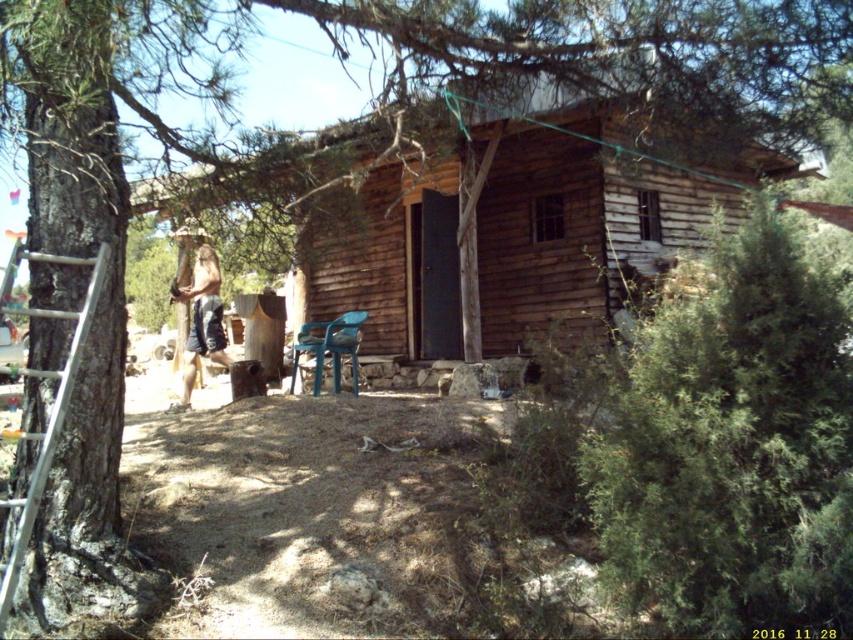
Is silver metallic ladder at left thinner than blue plastic chair at center?

Yes.

Which is in front, point (102, 244) or point (355, 394)?

Positioned in front is point (102, 244).

Is point (6, 500) closer to viewer compared to point (328, 324)?

That is True.

This screenshot has height=640, width=853. I want to click on silver metallic ladder at left, so click(x=50, y=408).

Which of these two, wooden log cabin at center or beige fabric shorts at center, stands shorter?

beige fabric shorts at center

Does wooden log cabin at center appear on the right side of beige fabric shorts at center?

Indeed, wooden log cabin at center is positioned on the right side of beige fabric shorts at center.

Which is behind, point (459, 353) or point (181, 300)?

The point (459, 353) is more distant.

Find the location of `wooden log cabin at center`. wooden log cabin at center is located at coordinates (519, 227).

Who is more distant from viewer, [88,317] or [177,300]?

Point [177,300]

Is point (76, 316) farther from viewer compared to point (206, 308)?

No, (76, 316) is closer to viewer.

Find the location of a particular element. This screenshot has width=853, height=640. silver metallic ladder at left is located at coordinates (50, 408).

Find the location of a particular element. This screenshot has height=640, width=853. silver metallic ladder at left is located at coordinates (50, 408).